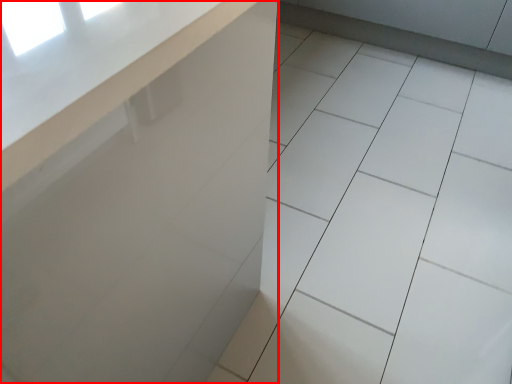
Question: From the image's perspective, what is the correct spatial relationship of counter (annotated by the red box) in relation to ceramic tile?

Choices:
 (A) below
 (B) above

Answer: (A)